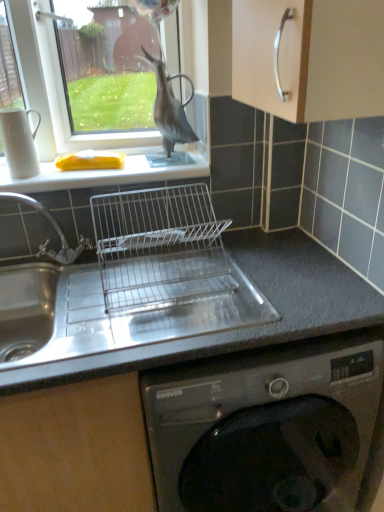
Question: From a real-world perspective, is clear glass window at upper left physically located above or below smooth gray countertop at center?

Choices:
 (A) below
 (B) above

Answer: (B)

Question: In terms of width, does clear glass window at upper left look wider or thinner when compared to smooth gray countertop at center?

Choices:
 (A) wide
 (B) thin

Answer: (B)

Question: Considering the real-world distances, which object is farthest from the smooth gray countertop at center?

Choices:
 (A) clear glass window at upper left
 (B) stainless steel sink at center
 (C) white matte sponge at upper left
 (D) matte black bird at upper center

Answer: (A)

Question: Which of these objects is positioned closest to the matte black bird at upper center?

Choices:
 (A) stainless steel sink at center
 (B) white matte sponge at upper left
 (C) smooth gray countertop at center
 (D) clear glass window at upper left

Answer: (D)